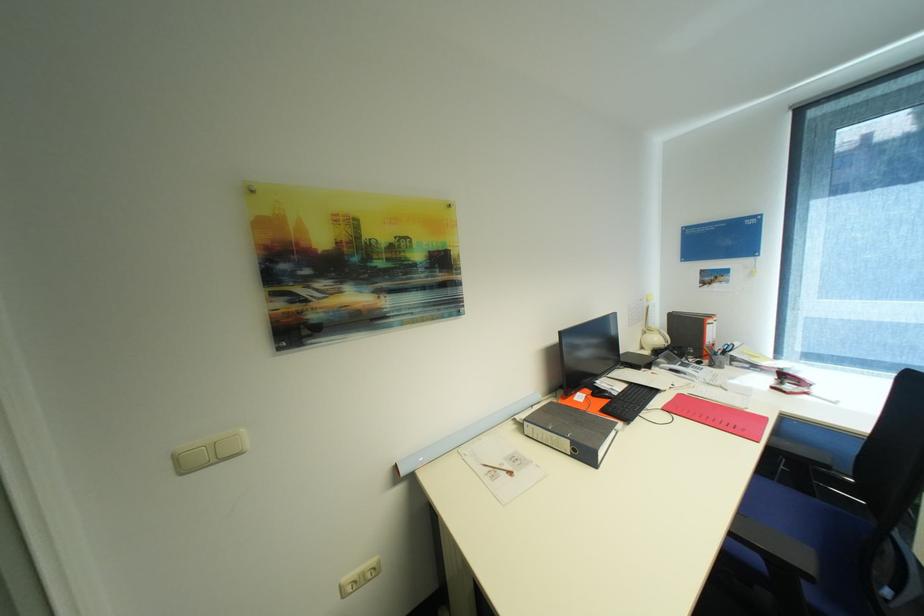
At what (x,y) coordinates should I click in order to perform the action: click on chair sitting surface. Please return your answer as a coordinate pair (x, y). The width and height of the screenshot is (924, 616). Looking at the image, I should click on (810, 525).